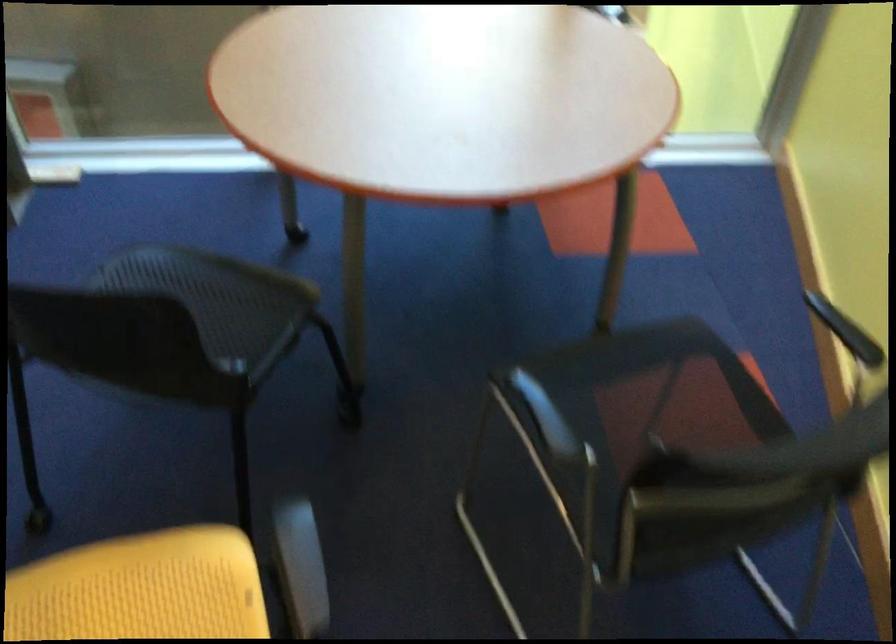
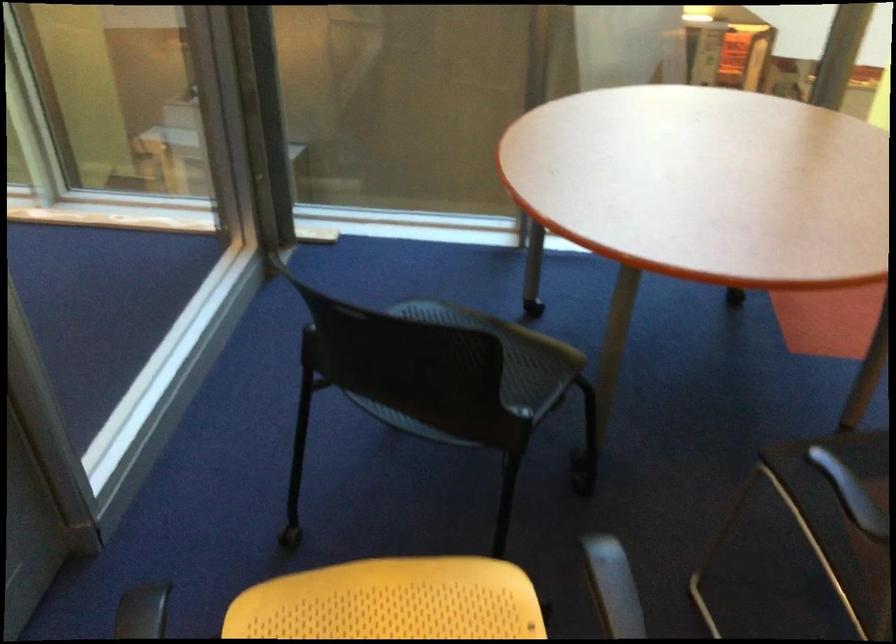
Question: The images are taken continuously from a first-person perspective. In which direction are you moving?

Choices:
 (A) Left
 (B) Right
 (C) Forward
 (D) Backward

Answer: (A)